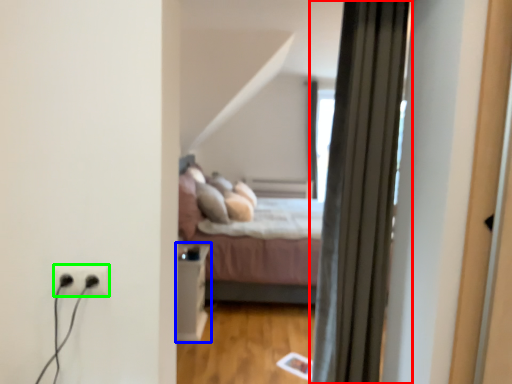
Question: Based on their relative distances, which object is nearer to curtain (highlighted by a red box)? Choose from table (highlighted by a blue box) and electric outlet (highlighted by a green box).

Choices:
 (A) table
 (B) electric outlet

Answer: (B)